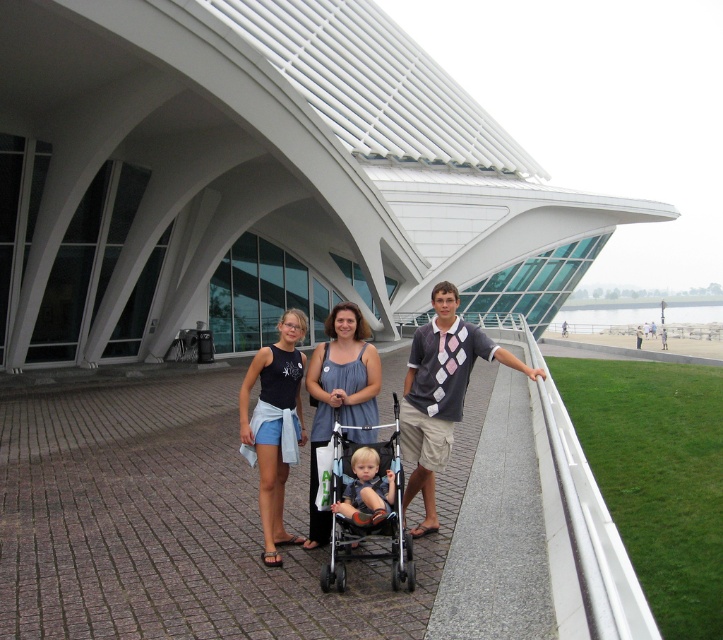
You are standing at point (252, 438) and want to walk to the building. There is an obstacle at point (414, 438). Can you walk straight ahead without passing behind the obstacle?

Point (414, 438) is behind point (252, 438), so walking straight ahead would require passing behind the obstacle at point (414, 438).

Consider the image. You are a photographer trying to capture a photo of the group without any obstructions. Since you want to ensure the matte gray stroller at center and the denim blue tank top at center are both visible, which object should you position lower in your camera frame?

The matte gray stroller at center is not as tall as the denim blue tank top at center, so you should position the matte gray stroller at center lower in your camera frame to ensure both are visible.